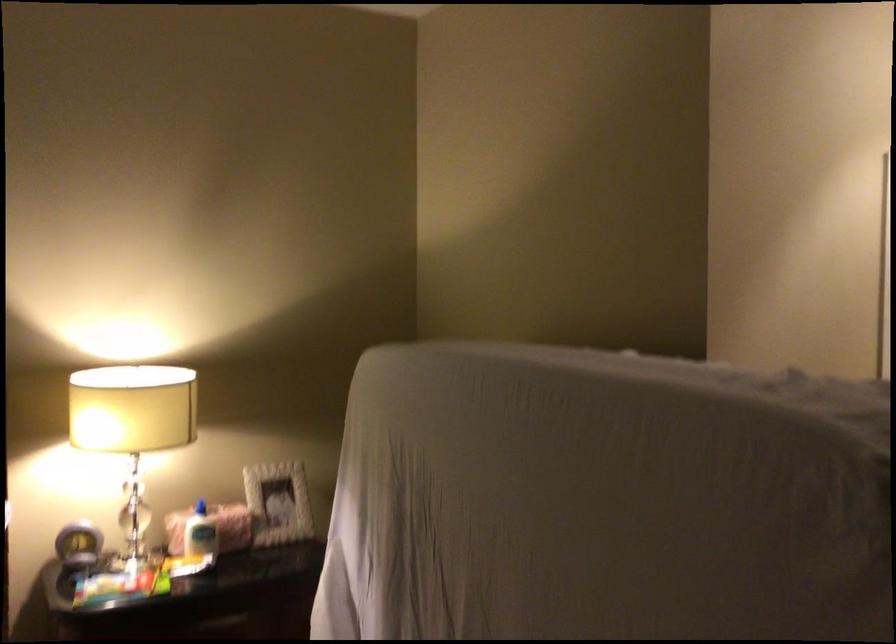
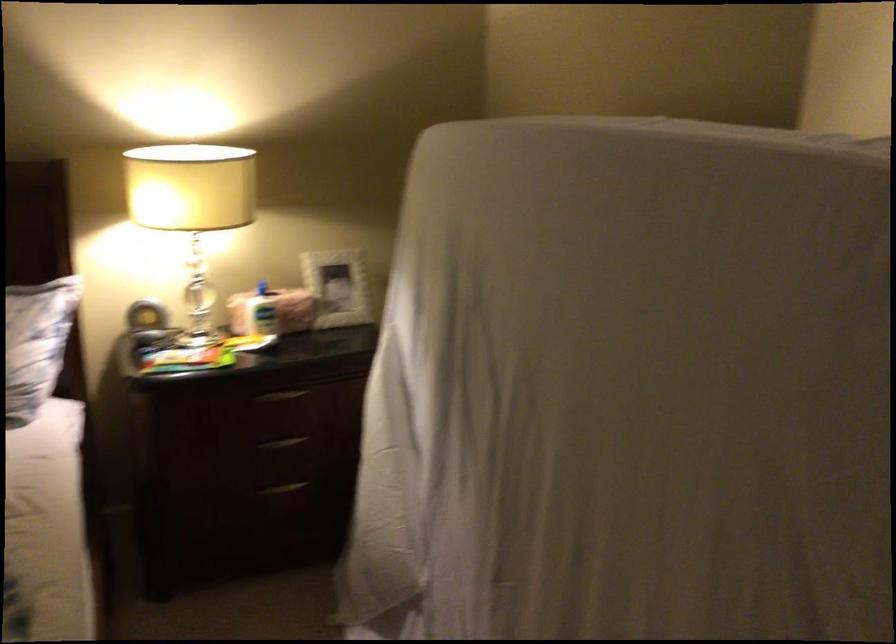
The point at (201, 507) is marked in the first image. Where is the corresponding point in the second image?

(262, 288)